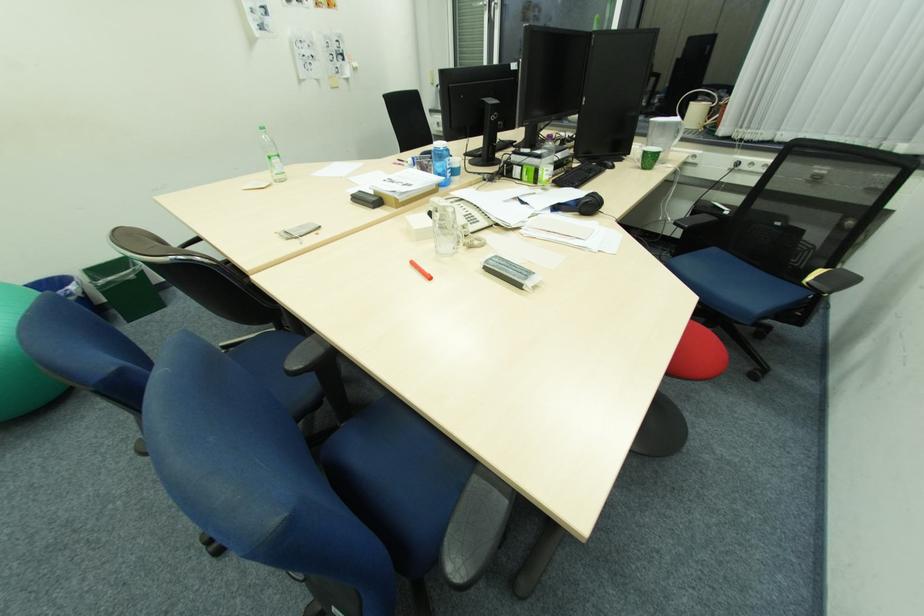
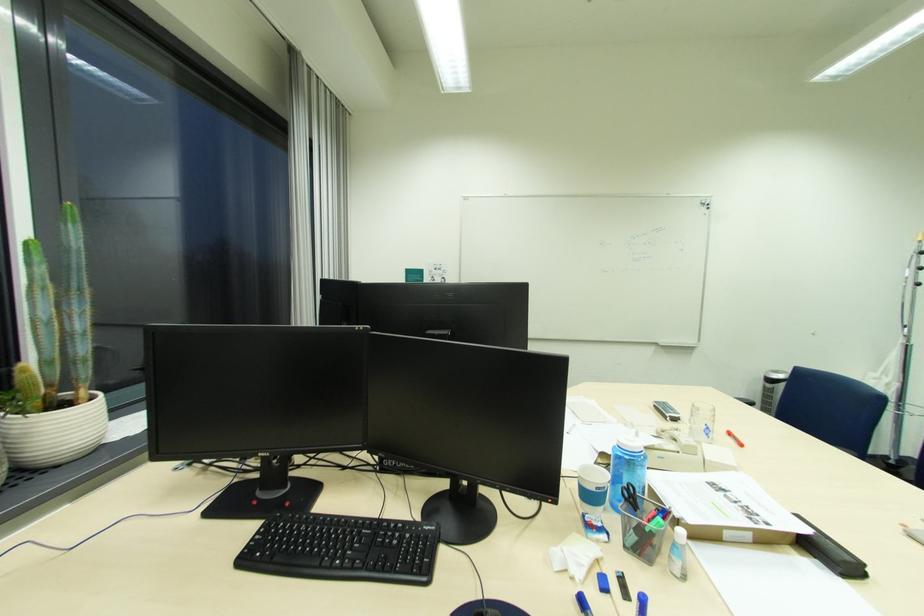
Locate, in the second image, the point that corresponds to the point at 434,278 in the first image.

(736, 435)